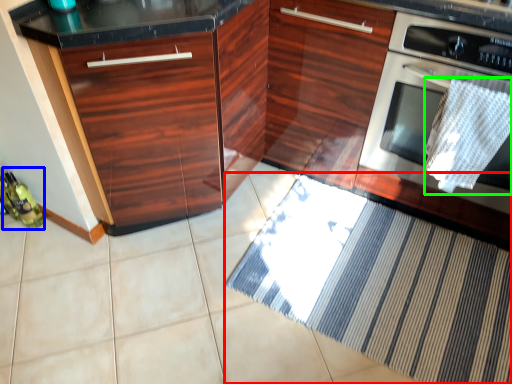
Question: Estimate the real-world distances between objects in this image. Which object is farther from doormat (highlighted by a red box), bottle (highlighted by a blue box) or blanket (highlighted by a green box)?

Choices:
 (A) bottle
 (B) blanket

Answer: (A)